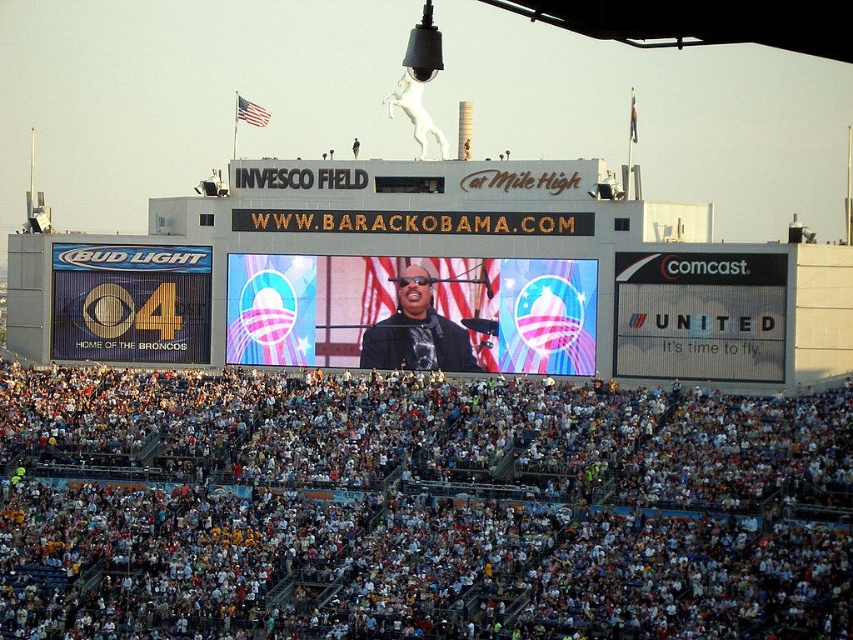
Is white cotton crowd at lower center to the right of matte black jacket at center from the viewer's perspective?

No, white cotton crowd at lower center is not to the right of matte black jacket at center.

Which is more to the left, white cotton crowd at lower center or matte black jacket at center?

From the viewer's perspective, white cotton crowd at lower center appears more on the left side.

The height and width of the screenshot is (640, 853). I want to click on white cotton crowd at lower center, so click(416, 508).

Which is in front, point (573, 634) or point (590, 360)?

Point (573, 634) is in front.

Is point (657, 609) closer to viewer compared to point (581, 316)?

Yes, it is.

You are a GUI agent. You are given a task and a screenshot of the screen. Output one action in this format:
    pyautogui.click(x=<x>, y=<y>)
    Task: Click on the white cotton crowd at lower center
    
    Given the screenshot: What is the action you would take?
    pyautogui.click(x=416, y=508)

Is shiny digital display at center in front of matte black jacket at center?

Yes, it is in front of matte black jacket at center.

Does shiny digital display at center have a lesser height compared to matte black jacket at center?

No.

Who is more forward, (238,362) or (421,300)?

Point (421,300) is in front.

The image size is (853, 640). Identify the location of shiny digital display at center. pyautogui.click(x=412, y=314).